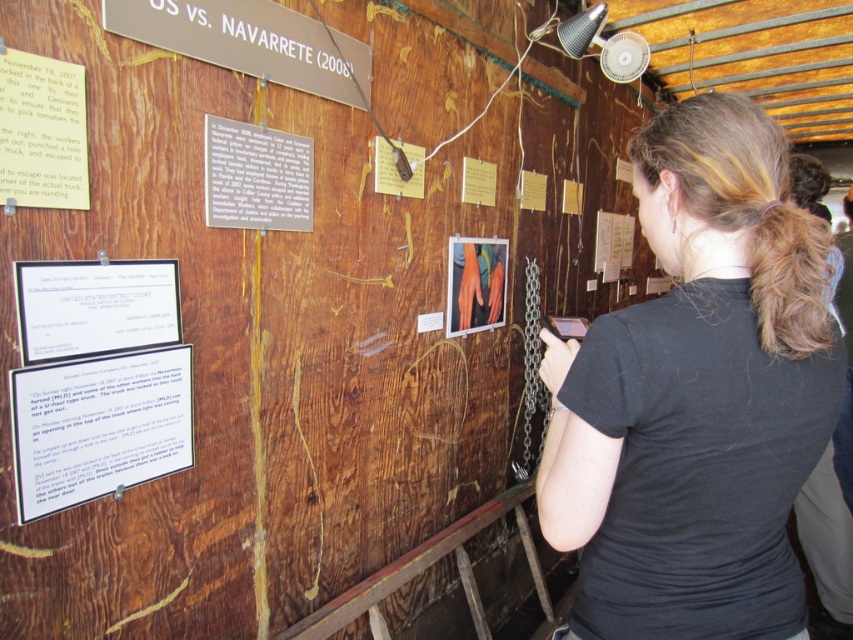
Does black cotton shirt at right come behind wooden sign at upper center?

No, it is in front of wooden sign at upper center.

Which is in front, point (721, 532) or point (231, 51)?

Point (721, 532) is in front.

This screenshot has height=640, width=853. Find the location of `black cotton shirt at right`. black cotton shirt at right is located at coordinates (695, 396).

Does white paper at lower left have a lesser height compared to wooden sign at upper center?

Incorrect, white paper at lower left's height does not fall short of wooden sign at upper center's.

Is point (132, 369) farther from viewer compared to point (268, 16)?

No, (132, 369) is in front of (268, 16).

Does point (54, 506) come behind point (172, 42)?

No, (54, 506) is closer to viewer.

Locate an element on the screen. white paper at lower left is located at coordinates (97, 426).

Is black cotton shirt at right taller than blonde curly hair at upper right?

Indeed, black cotton shirt at right has a greater height compared to blonde curly hair at upper right.

Which of these two, black cotton shirt at right or blonde curly hair at upper right, stands taller?

Standing taller between the two is black cotton shirt at right.

Based on the photo, who is more distant from viewer, (711,637) or (763,260)?

Point (711,637)

Find the location of `black cotton shirt at right`. black cotton shirt at right is located at coordinates (695, 396).